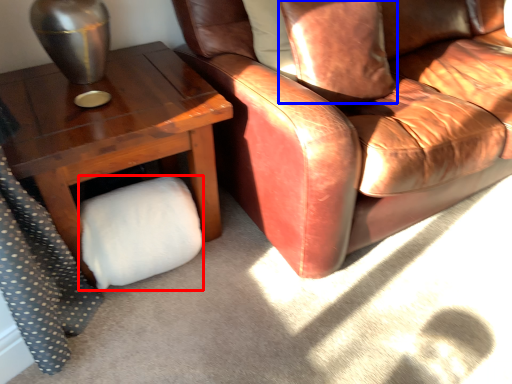
Question: Which of the following is the closest to the observer, toilet paper (highlighted by a red box) or pillow (highlighted by a blue box)?

Choices:
 (A) toilet paper
 (B) pillow

Answer: (A)